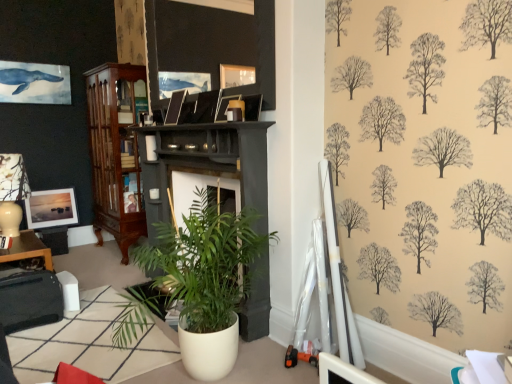
Find the location of a particular element. The image size is (512, 384). free spot above white glossy table at lower left, placed as the 2th table when sorted from left to right (from a real-world perspective) is located at coordinates (76, 339).